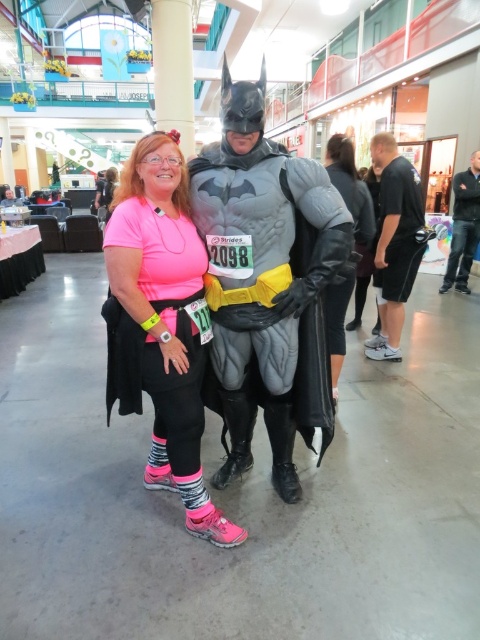
Question: Is black mesh shorts at right behind leather jacket at right?

Choices:
 (A) yes
 (B) no

Answer: (A)

Question: Can you confirm if black mesh shorts at right is thinner than black leather jacket at right?

Choices:
 (A) yes
 (B) no

Answer: (A)

Question: Can you confirm if neon pink fabric leggings at center is positioned to the right of black mesh shorts at right?

Choices:
 (A) no
 (B) yes

Answer: (A)

Question: Which of the following is the farthest from the observer?

Choices:
 (A) black mesh shorts at right
 (B) neon pink fabric leggings at center
 (C) black leather jacket at right
 (D) leather jacket at right

Answer: (C)

Question: Based on their relative distances, which object is farther from the neon pink fabric leggings at center?

Choices:
 (A) black leather jacket at right
 (B) leather jacket at right
 (C) black mesh shorts at right

Answer: (A)

Question: Which object is the farthest from the leather jacket at right?

Choices:
 (A) black leather jacket at right
 (B) neon pink fabric leggings at center
 (C) black mesh shorts at right

Answer: (A)